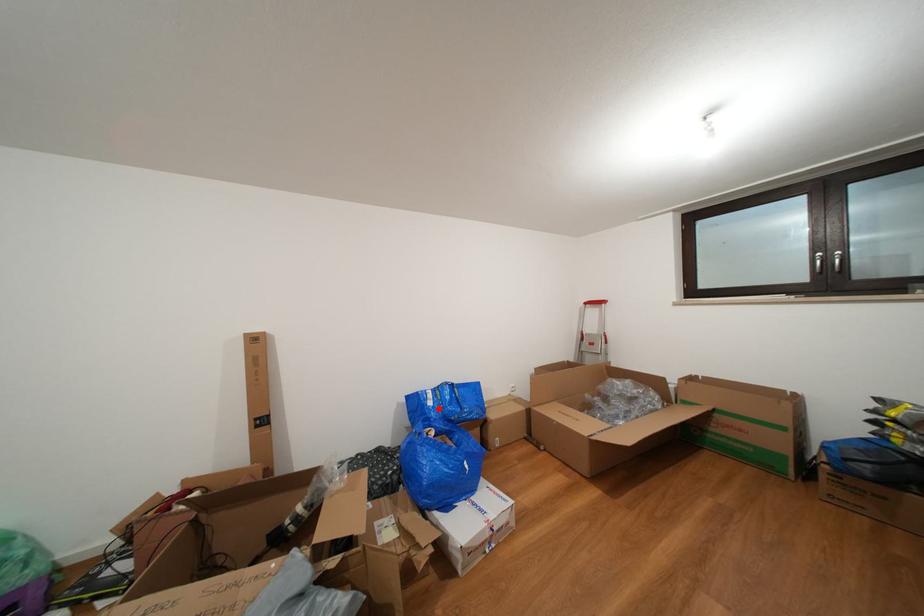
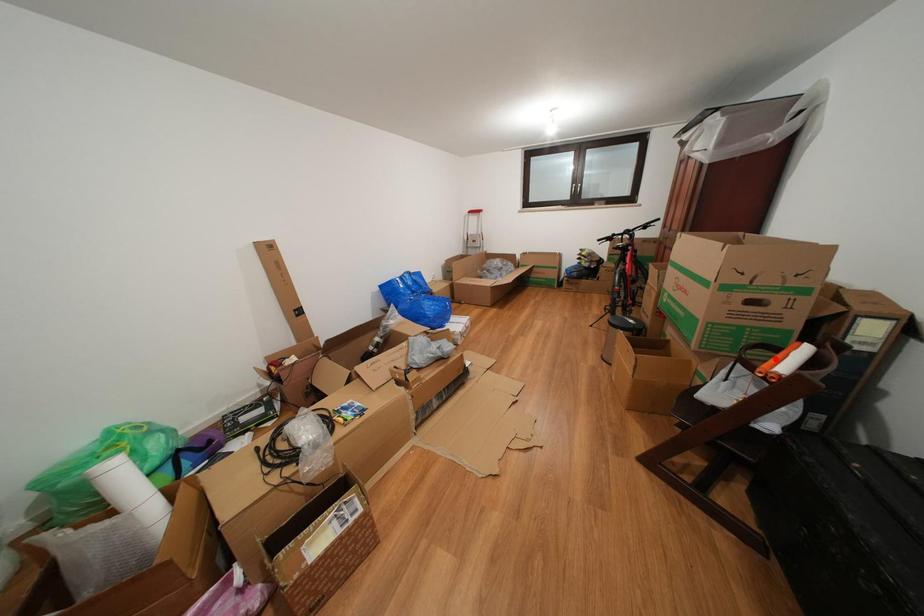
I am providing you with two images of the same scene from different viewpoints. A red point is marked on the first image and another point is marked on the second image. Are the points marked in image1 and image2 representing the same 3D position?

No